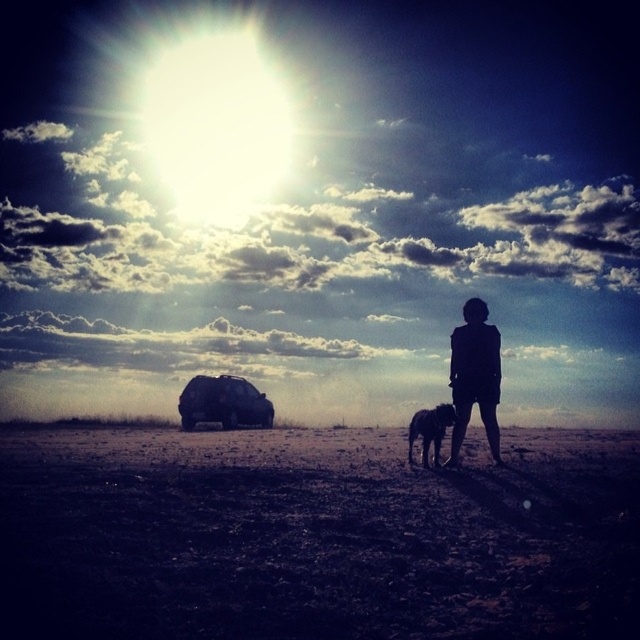
Is silhouette figure at center taller than satin black suv at lower center?

Indeed, silhouette figure at center has a greater height compared to satin black suv at lower center.

Does silhouette figure at center have a greater width compared to satin black suv at lower center?

In fact, silhouette figure at center might be narrower than satin black suv at lower center.

Image resolution: width=640 pixels, height=640 pixels. In order to click on silhouette figure at center in this screenshot , I will do `click(474, 376)`.

In order to click on silhouette figure at center in this screenshot , I will do `click(474, 376)`.

Where is `satin black suv at lower center`? The image size is (640, 640). satin black suv at lower center is located at coordinates (224, 403).

Can you confirm if satin black suv at lower center is smaller than shiny black dog at center?

No.

Which is behind, point (237, 422) or point (436, 445)?

Positioned behind is point (237, 422).

Image resolution: width=640 pixels, height=640 pixels. What are the coordinates of `satin black suv at lower center` in the screenshot? It's located at (224, 403).

Is dark brown dirt field at center to the right of silhouette figure at center from the viewer's perspective?

In fact, dark brown dirt field at center is to the left of silhouette figure at center.

Measure the distance between dark brown dirt field at center and silhouette figure at center.

7.93 feet

Between point (291, 563) and point (486, 369), which one is positioned in front?

Point (291, 563) is in front.

Identify the location of dark brown dirt field at center. This screenshot has height=640, width=640. (314, 538).